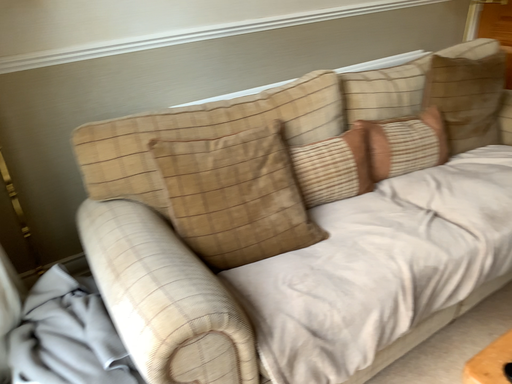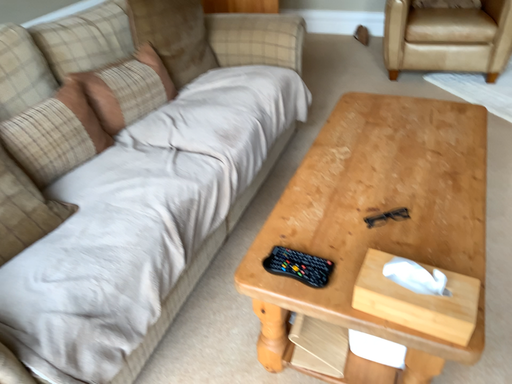
Question: How did the camera likely rotate when shooting the video?

Choices:
 (A) rotated left
 (B) rotated right

Answer: (B)